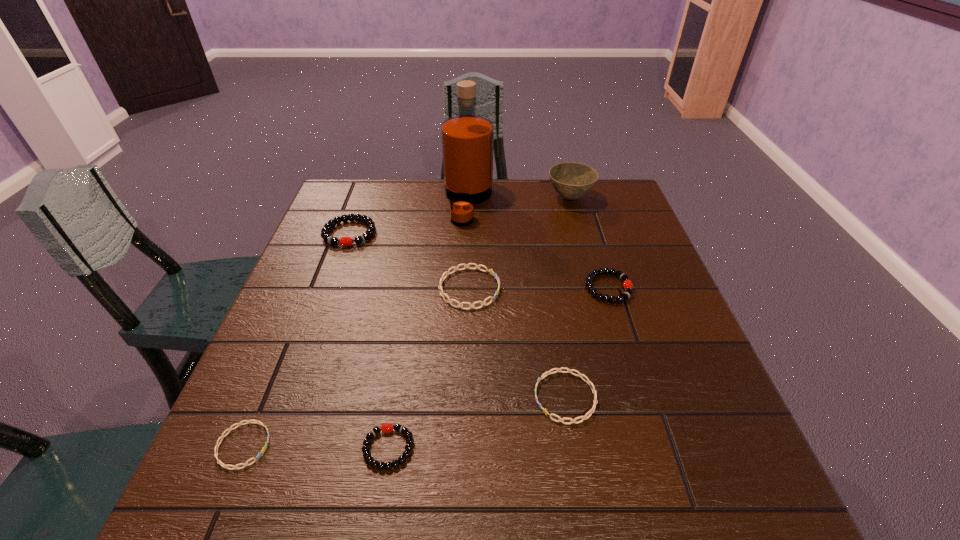
This screenshot has width=960, height=540. Identify the location of the smallest black bracelet. (386, 428).

Where is `the second black bracelet from right to left`? the second black bracelet from right to left is located at coordinates (386, 428).

Locate an element on the screen. the leftmost blue bracelet is located at coordinates (263, 450).

You are a GUI agent. You are given a task and a screenshot of the screen. Output one action in this format:
    pyautogui.click(x=<x>, y=<y>)
    Task: Click on the smallest blue bracelet
    Image resolution: width=960 pixels, height=540 pixels.
    Given the screenshot: What is the action you would take?
    pyautogui.click(x=263, y=450)

Find the location of a particular element. This screenshot has width=960, height=540. vacant area located on the front label of the tallest object is located at coordinates (619, 202).

Image resolution: width=960 pixels, height=540 pixels. I want to click on vacant space situated on the front of the bowl, so click(584, 246).

The width and height of the screenshot is (960, 540). I want to click on vacant space located 0.160m on the back of the leftmost black bracelet, so click(366, 190).

The height and width of the screenshot is (540, 960). In order to click on free region located on the surface of the farthest blue bracelet showing star-shaped elements in this screenshot , I will do `click(578, 288)`.

The width and height of the screenshot is (960, 540). I want to click on vacant space located on the front of the second smallest black bracelet, so click(657, 443).

At what (x,y) coordinates should I click in order to perform the action: click on free space located on the surface of the rightmost blue bracelet showing star-shaped elements. Please return your answer as a coordinate pair (x, y). The image size is (960, 540). Looking at the image, I should click on (337, 397).